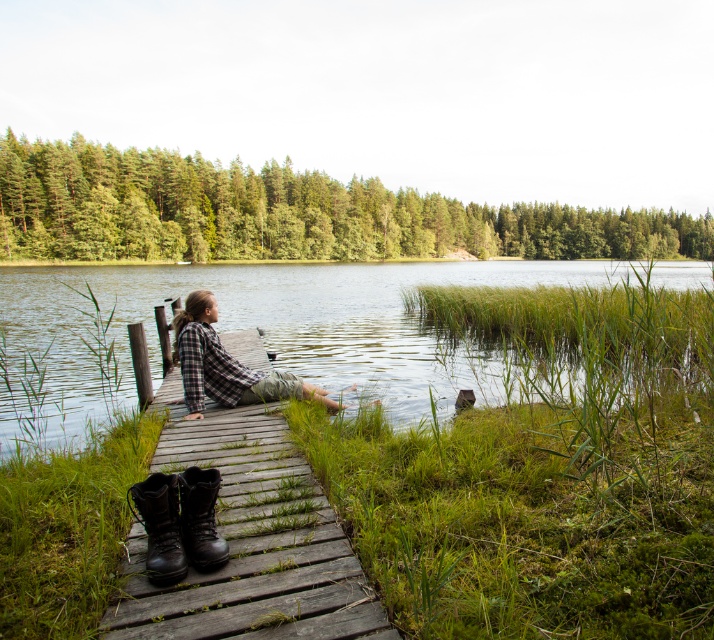
Which of these two, plaid fabric shirt at center or black leather boot at lower center, stands shorter?

black leather boot at lower center

Which is behind, point (238, 371) or point (213, 522)?

The point (238, 371) is more distant.

Image resolution: width=714 pixels, height=640 pixels. What do you see at coordinates (208, 368) in the screenshot? I see `plaid fabric shirt at center` at bounding box center [208, 368].

Where is `plaid fabric shirt at center`? The image size is (714, 640). plaid fabric shirt at center is located at coordinates (208, 368).

In the scene shown: Which is below, plaid flannel shirt at center or plaid fabric shirt at center?

Positioned lower is plaid flannel shirt at center.

How much distance is there between plaid flannel shirt at center and plaid fabric shirt at center?

They are 4.80 inches apart.

Locate an element on the screen. The image size is (714, 640). plaid flannel shirt at center is located at coordinates (226, 365).

Identify the location of plaid flannel shirt at center. pos(226,365).

Who is taller, clear water at dock center or black leather boots at lower left?

clear water at dock center is taller.

Can you confirm if clear water at dock center is bigger than black leather boots at lower left?

Yes, clear water at dock center is bigger than black leather boots at lower left.

Who is more distant from viewer, (x=135, y=320) or (x=164, y=541)?

Point (x=135, y=320)

At what (x,y) coordinates should I click in order to perform the action: click on clear water at dock center. Please return your answer as a coordinate pair (x, y). The height and width of the screenshot is (640, 714). Looking at the image, I should click on (268, 326).